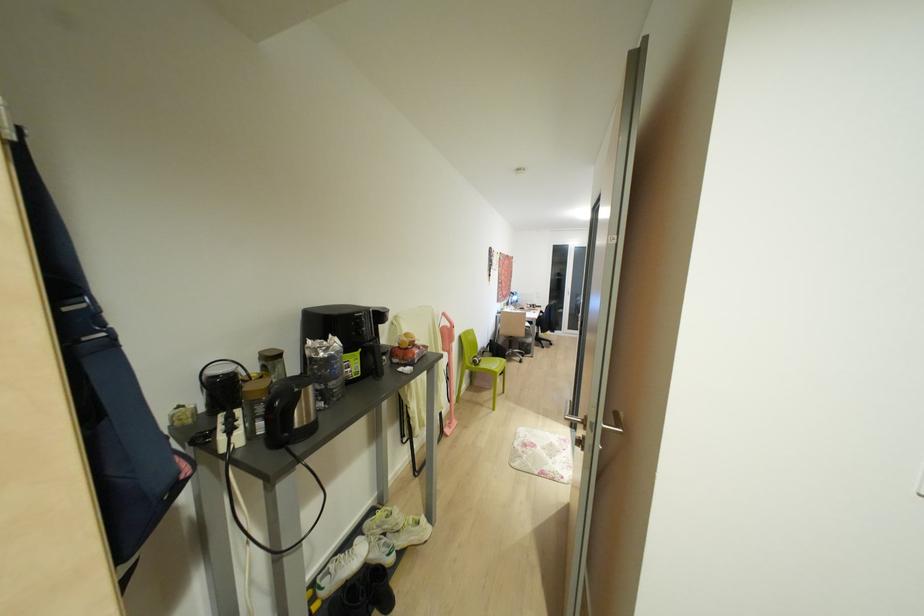
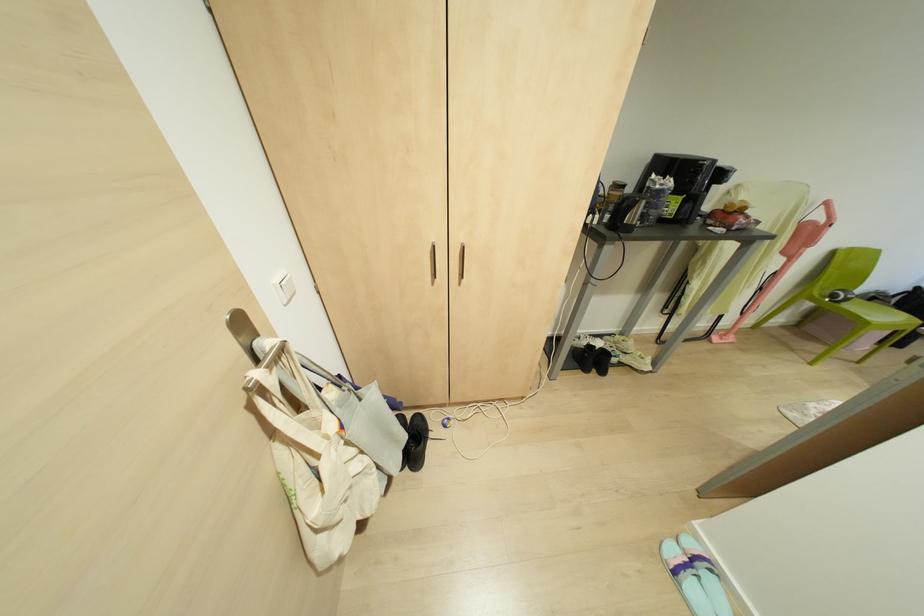
In the second image, find the point that corresponds to the point at 473,361 in the first image.

(833, 294)